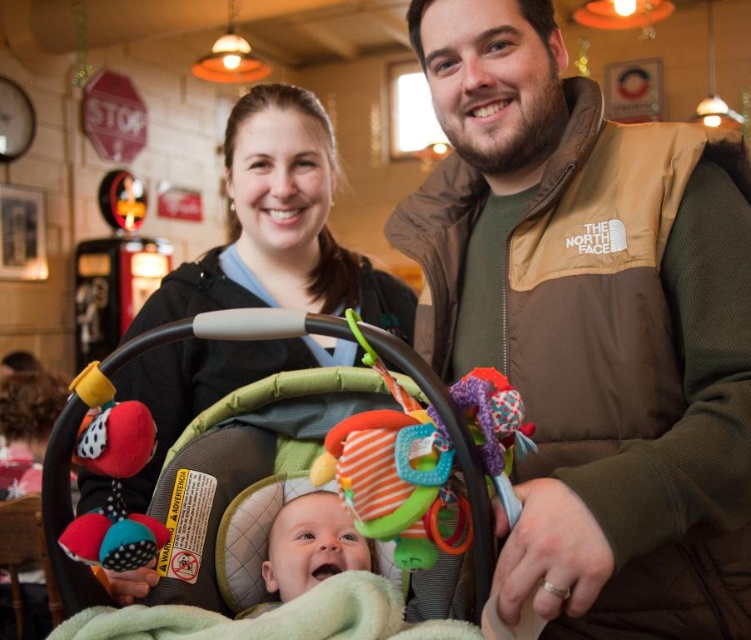
Who is higher up, matte black jacket at center or soft green blanket at center?

matte black jacket at center

Does matte black jacket at center appear over soft green blanket at center?

Yes.

Identify the location of matte black jacket at center. (279, 227).

Can you confirm if brown fleece vest at center is shorter than matte black jacket at center?

In fact, brown fleece vest at center may be taller than matte black jacket at center.

Consider the image. Can you confirm if brown fleece vest at center is taller than matte black jacket at center?

Yes, brown fleece vest at center is taller than matte black jacket at center.

Who is more forward, (593, 307) or (318, 276)?

Point (593, 307) is in front.

The width and height of the screenshot is (751, 640). What are the coordinates of `brown fleece vest at center` in the screenshot? It's located at (590, 324).

Between green fabric baby carriage at center and matte black jacket at center, which one is positioned lower?

green fabric baby carriage at center

Between green fabric baby carriage at center and matte black jacket at center, which one appears on the right side from the viewer's perspective?

green fabric baby carriage at center

You are a GUI agent. You are given a task and a screenshot of the screen. Output one action in this format:
    pyautogui.click(x=<x>, y=<y>)
    Task: Click on the green fabric baby carriage at center
    This screenshot has height=640, width=751.
    Given the screenshot: What is the action you would take?
    pyautogui.click(x=339, y=490)